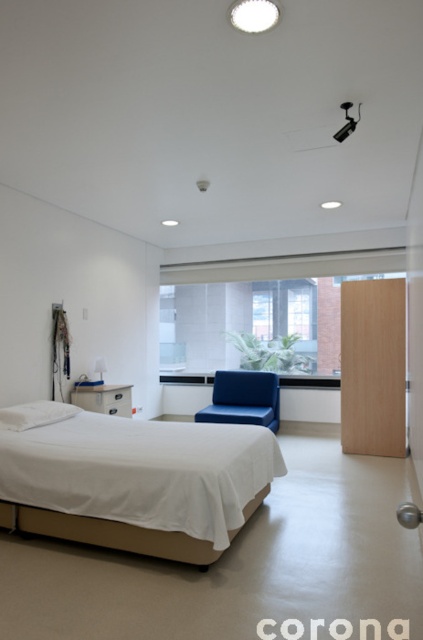
How much distance is there between white fabric bed at lower left and matte blue armchair at center?

7.10 feet

Is white fabric bed at lower left below matte blue armchair at center?

Yes.

This screenshot has width=423, height=640. Identify the location of white fabric bed at lower left. (137, 483).

Which is above, white fabric bed at lower left or white fluffy pillow at center?

white fluffy pillow at center is higher up.

Measure the distance between point (142, 540) and camera.

A distance of 9.43 feet exists between point (142, 540) and camera.

Find the location of a particular element. white fabric bed at lower left is located at coordinates (137, 483).

Is clear glass window at center thinner than white fluffy pillow at center?

In fact, clear glass window at center might be wider than white fluffy pillow at center.

Is clear glass window at center taller than white fluffy pillow at center?

Correct, clear glass window at center is much taller as white fluffy pillow at center.

Describe the element at coordinates (252, 326) in the screenshot. I see `clear glass window at center` at that location.

This screenshot has width=423, height=640. I want to click on clear glass window at center, so click(252, 326).